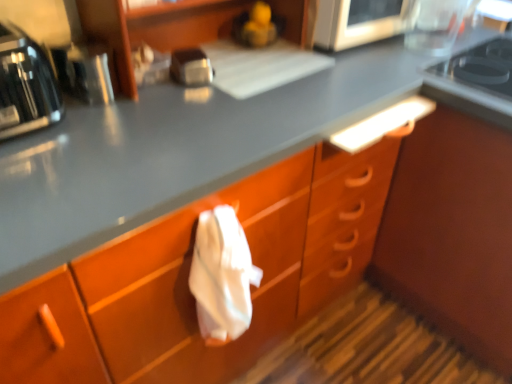
This screenshot has width=512, height=384. In order to click on vacant area that is situated to the right of metallic silver toaster at left, the 2th appliance from the top in this screenshot , I will do `click(162, 104)`.